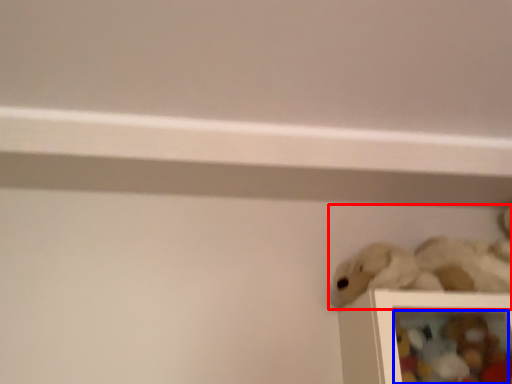
Question: Which point is further to the camera, toy (highlighted by a red box) or toy (highlighted by a blue box)?

Choices:
 (A) toy
 (B) toy

Answer: (B)